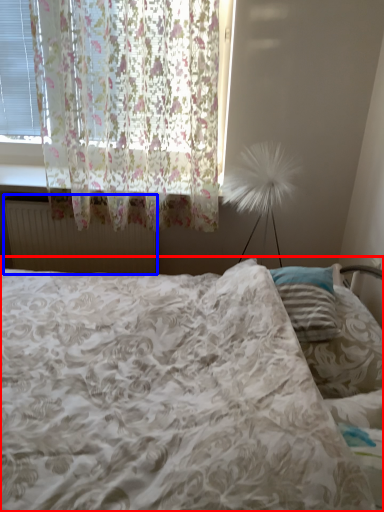
Question: Which object appears farthest to the camera in this image, bed (highlighted by a red box) or radiator (highlighted by a blue box)?

Choices:
 (A) bed
 (B) radiator

Answer: (B)